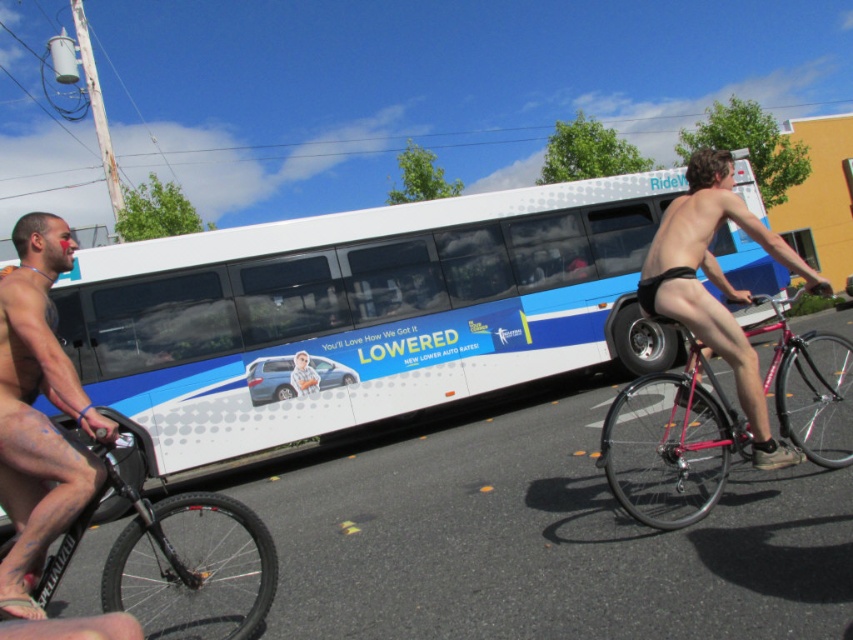
How far apart are matte black shorts at left and black matte shorts at right?

matte black shorts at left and black matte shorts at right are 3.37 meters apart.

Image resolution: width=853 pixels, height=640 pixels. I want to click on matte black shorts at left, so click(38, 413).

Is shiny red bicycle at center to the right of black matte shorts at right from the viewer's perspective?

Incorrect, shiny red bicycle at center is not on the right side of black matte shorts at right.

Which is more to the right, shiny red bicycle at center or black matte shorts at right?

Positioned to the right is black matte shorts at right.

Based on the photo, who is more forward, [637,486] or [643,285]?

Positioned in front is point [643,285].

At what (x,y) coordinates should I click in order to perform the action: click on shiny red bicycle at center. Please return your answer as a coordinate pair (x, y). This screenshot has height=640, width=853. Looking at the image, I should click on (670, 445).

Between point (548, 250) and point (157, 522), which one is positioned behind?

Point (548, 250)

Can you confirm if white matte bus at center is thinner than black matte bicycle at left?

In fact, white matte bus at center might be wider than black matte bicycle at left.

Image resolution: width=853 pixels, height=640 pixels. I want to click on white matte bus at center, so click(358, 314).